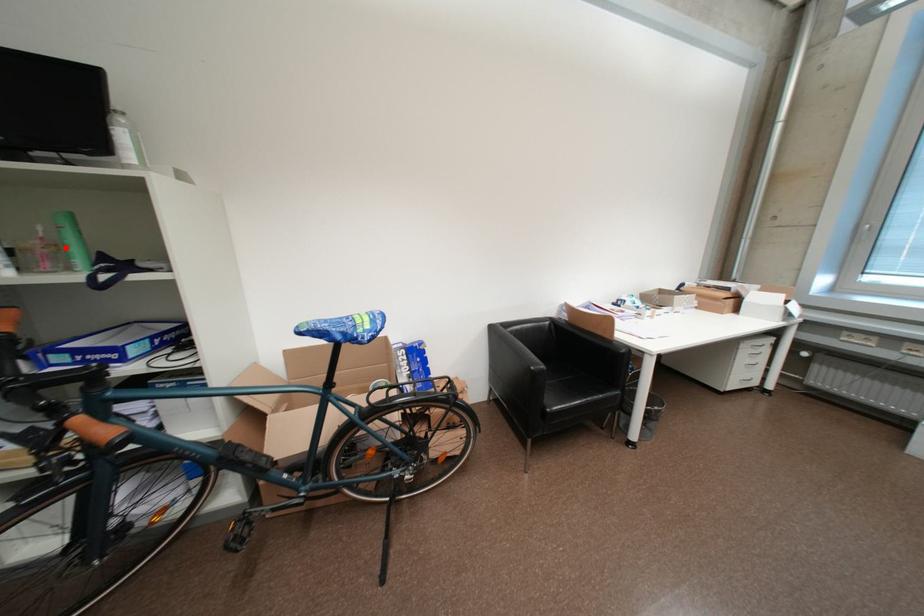
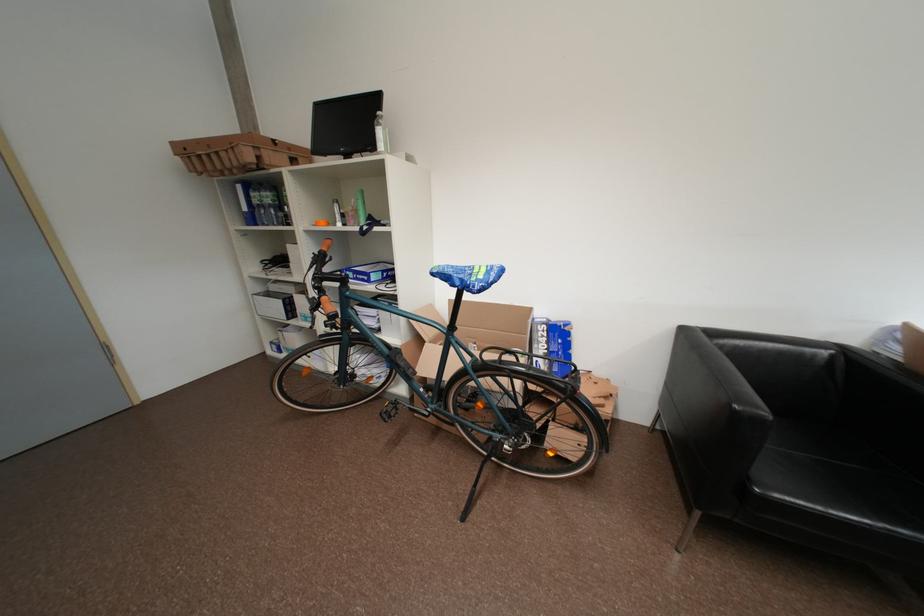
Where in the second image is the point corresponding to the highlighted location from the first image?

(363, 213)